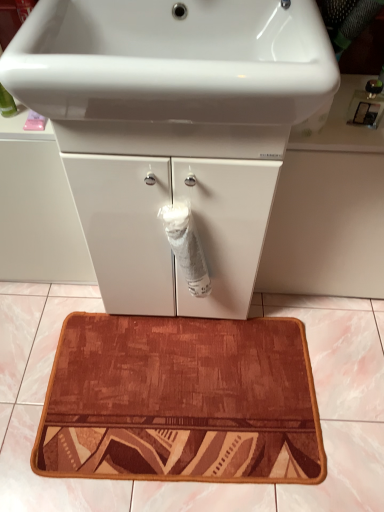
Question: Can you confirm if white matte toilet paper at center is positioned to the right of brown textured bath mat at center?

Choices:
 (A) yes
 (B) no

Answer: (A)

Question: From the image's perspective, does white matte toilet paper at center appear higher than brown textured bath mat at center?

Choices:
 (A) no
 (B) yes

Answer: (B)

Question: Considering the relative sizes of white matte toilet paper at center and brown textured bath mat at center in the image provided, is white matte toilet paper at center taller than brown textured bath mat at center?

Choices:
 (A) yes
 (B) no

Answer: (A)

Question: Does white matte toilet paper at center have a larger size compared to brown textured bath mat at center?

Choices:
 (A) no
 (B) yes

Answer: (A)

Question: Would you say white matte toilet paper at center is outside brown textured bath mat at center?

Choices:
 (A) yes
 (B) no

Answer: (A)

Question: Can you confirm if white matte toilet paper at center is wider than brown textured bath mat at center?

Choices:
 (A) no
 (B) yes

Answer: (A)

Question: Is white matte toilet paper at center completely or partially outside of white glossy sink at upper center?

Choices:
 (A) no
 (B) yes

Answer: (B)

Question: Is white matte toilet paper at center closer to camera compared to white glossy sink at upper center?

Choices:
 (A) yes
 (B) no

Answer: (B)

Question: From the image's perspective, is white matte toilet paper at center on top of white glossy sink at upper center?

Choices:
 (A) yes
 (B) no

Answer: (B)

Question: Is white matte toilet paper at center wider than white glossy sink at upper center?

Choices:
 (A) yes
 (B) no

Answer: (B)

Question: Is white matte toilet paper at center looking in the opposite direction of white glossy sink at upper center?

Choices:
 (A) yes
 (B) no

Answer: (B)

Question: Can you confirm if white matte toilet paper at center is positioned to the right of white glossy sink at upper center?

Choices:
 (A) no
 (B) yes

Answer: (B)

Question: Is white glossy cabinet at center located outside white glossy sink at upper center?

Choices:
 (A) yes
 (B) no

Answer: (A)